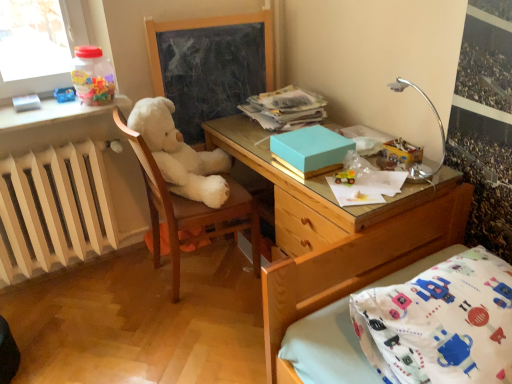
In order to click on vacant space situated on the left part of matte brown teddy bear at upper right, acting as the second toy starting from the left in this screenshot , I will do `click(334, 177)`.